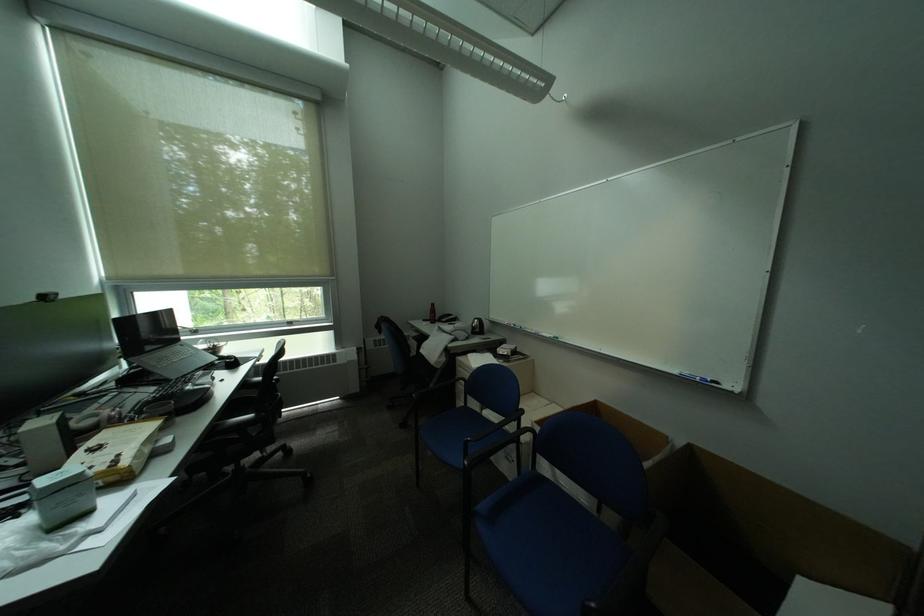
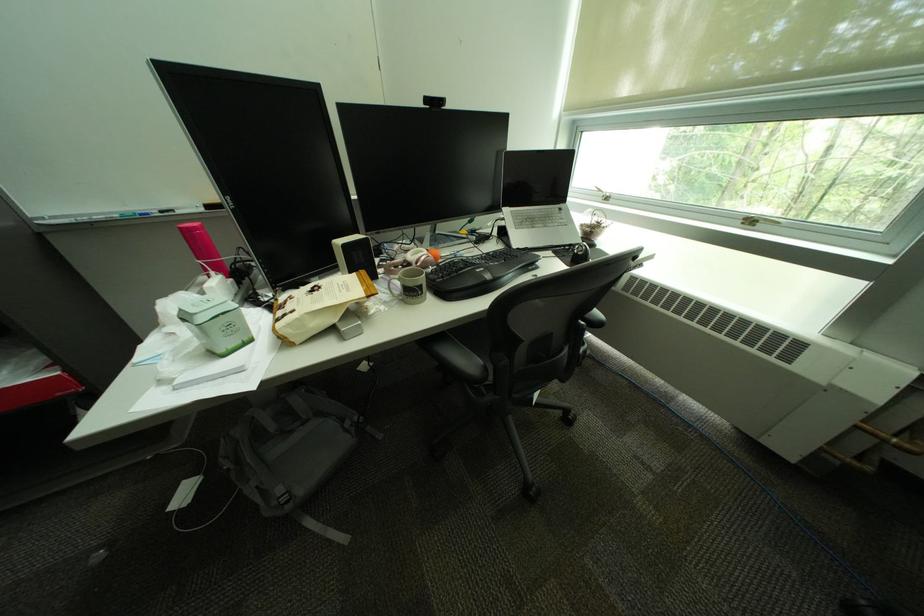
Locate, in the second image, the point that corresponds to point (224, 363) in the first image.

(580, 246)